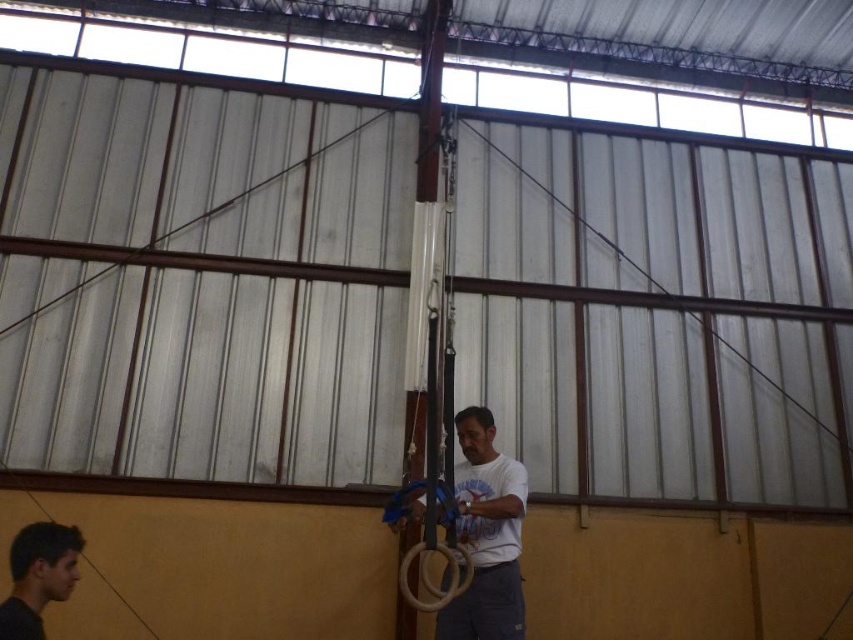
Is white glossy pole at center smaller than smooth skin face at lower left?

No, white glossy pole at center is not smaller than smooth skin face at lower left.

Is white glossy pole at center wider than smooth skin face at lower left?

Yes, white glossy pole at center is wider than smooth skin face at lower left.

Between point (442, 51) and point (77, 548), which one is positioned in front?

Point (77, 548) is more forward.

Find the location of a particular element. This screenshot has height=640, width=853. white glossy pole at center is located at coordinates (426, 257).

In order to click on white glossy pole at center in this screenshot , I will do `click(426, 257)`.

Does point (410, 273) lie behind point (503, 499)?

That is True.

At what (x,y) coordinates should I click in order to perform the action: click on white glossy pole at center. Please return your answer as a coordinate pair (x, y). Looking at the image, I should click on (426, 257).

The height and width of the screenshot is (640, 853). What are the coordinates of `white glossy pole at center` in the screenshot? It's located at (426, 257).

Does white matte gymnastic rings at center have a greater height compared to smooth skin face at lower left?

Yes, white matte gymnastic rings at center is taller than smooth skin face at lower left.

Between white matte gymnastic rings at center and smooth skin face at lower left, which one has more height?

white matte gymnastic rings at center

Between point (495, 472) and point (65, 576), which one is positioned in front?

Point (65, 576)

Identify the location of white matte gymnastic rings at center. (486, 534).